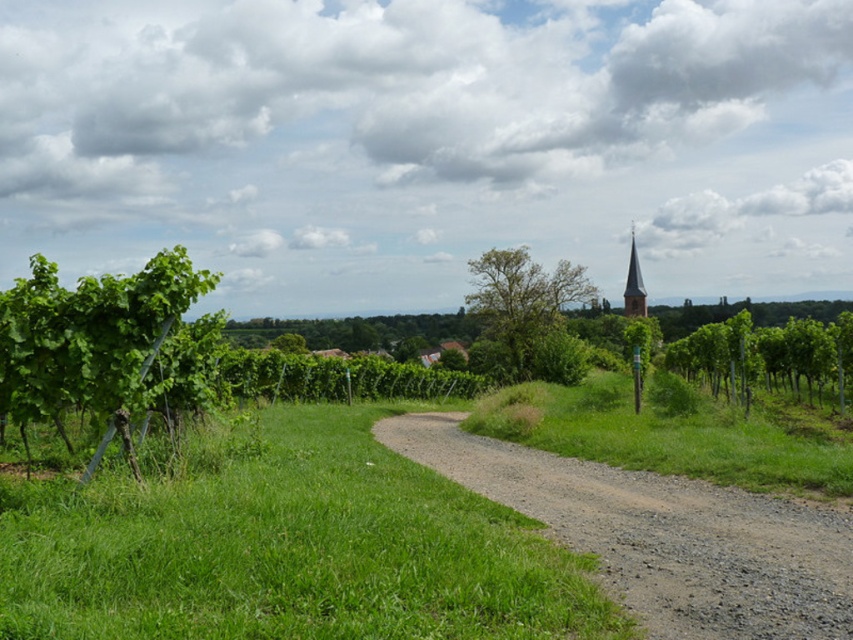
Between green leafy tree at center and brown wooden spire at upper center, which one appears on the right side from the viewer's perspective?

brown wooden spire at upper center is more to the right.

Does green leafy tree at center come in front of brown wooden spire at upper center?

Yes, green leafy tree at center is closer to the viewer.

Describe the element at coordinates (521, 296) in the screenshot. I see `green leafy tree at center` at that location.

Identify the location of green leafy tree at center. The width and height of the screenshot is (853, 640). (521, 296).

Image resolution: width=853 pixels, height=640 pixels. Describe the element at coordinates (662, 534) in the screenshot. I see `dusty gravel path at center` at that location.

Based on the photo, can you confirm if dusty gravel path at center is bigger than green leafy vine at right?

Actually, dusty gravel path at center might be smaller than green leafy vine at right.

Is point (451, 456) positioned before point (805, 364)?

Yes, point (451, 456) is in front of point (805, 364).

The image size is (853, 640). I want to click on dusty gravel path at center, so click(662, 534).

Which is behind, point (793, 371) or point (631, 256)?

Positioned behind is point (631, 256).

Who is higher up, green leafy vine at right or brown wooden spire at upper center?

brown wooden spire at upper center is above.

Between point (724, 387) and point (630, 234), which one is positioned in front?

Point (724, 387) is more forward.

At what (x,y) coordinates should I click in order to perform the action: click on green leafy vine at right. Please return your answer as a coordinate pair (x, y). Looking at the image, I should click on 767,355.